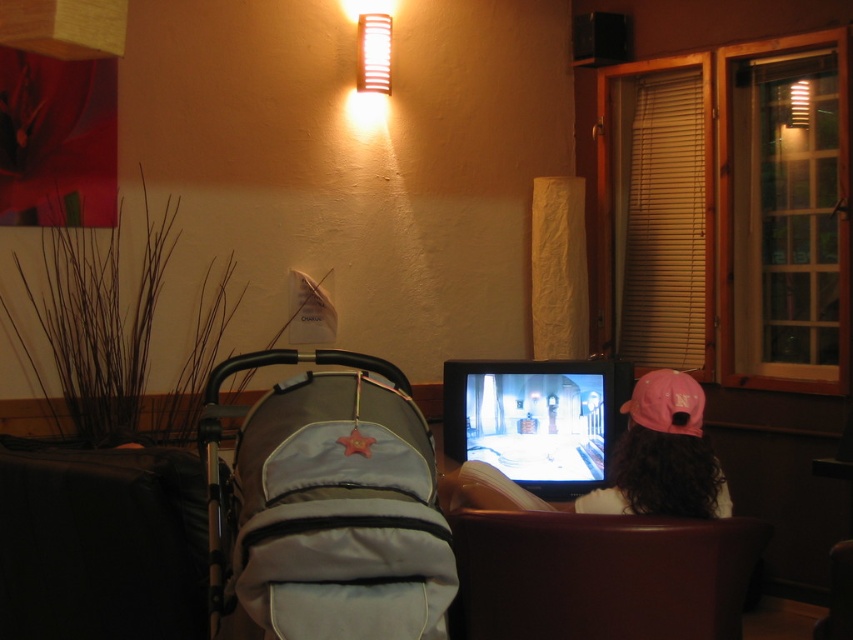
Between brown leather armchair at lower center and pink fabric cap at upper right, which one is positioned higher?

pink fabric cap at upper right is above.

How far apart are brown leather armchair at lower center and pink fabric cap at upper right?

brown leather armchair at lower center and pink fabric cap at upper right are 10.21 inches apart from each other.

Is point (485, 632) closer to camera compared to point (466, 474)?

Yes.

This screenshot has height=640, width=853. I want to click on brown leather armchair at lower center, so click(x=601, y=576).

Can you confirm if light gray fabric baby carriage at center-left is positioned to the right of pink fabric cap at upper right?

In fact, light gray fabric baby carriage at center-left is to the left of pink fabric cap at upper right.

Does light gray fabric baby carriage at center-left have a smaller size compared to pink fabric cap at upper right?

Yes.

Between point (320, 396) and point (532, 499), which one is positioned in front?

Point (320, 396) is in front.

Identify the location of light gray fabric baby carriage at center-left. The image size is (853, 640). (328, 504).

Is brown leather armchair at lower center thinner than pink fabric baseball cap at right?

No.

Describe the element at coordinates (601, 576) in the screenshot. Image resolution: width=853 pixels, height=640 pixels. I see `brown leather armchair at lower center` at that location.

I want to click on brown leather armchair at lower center, so click(601, 576).